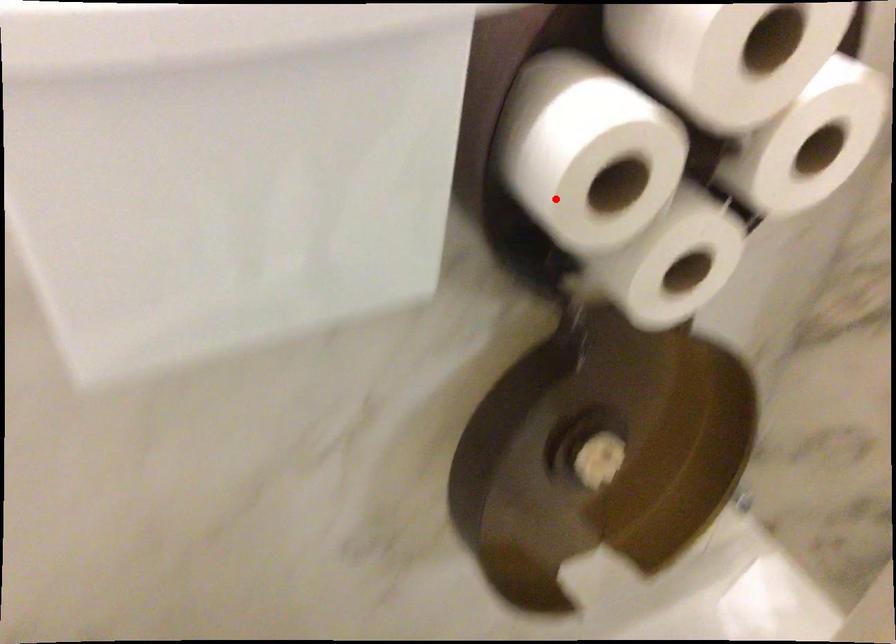
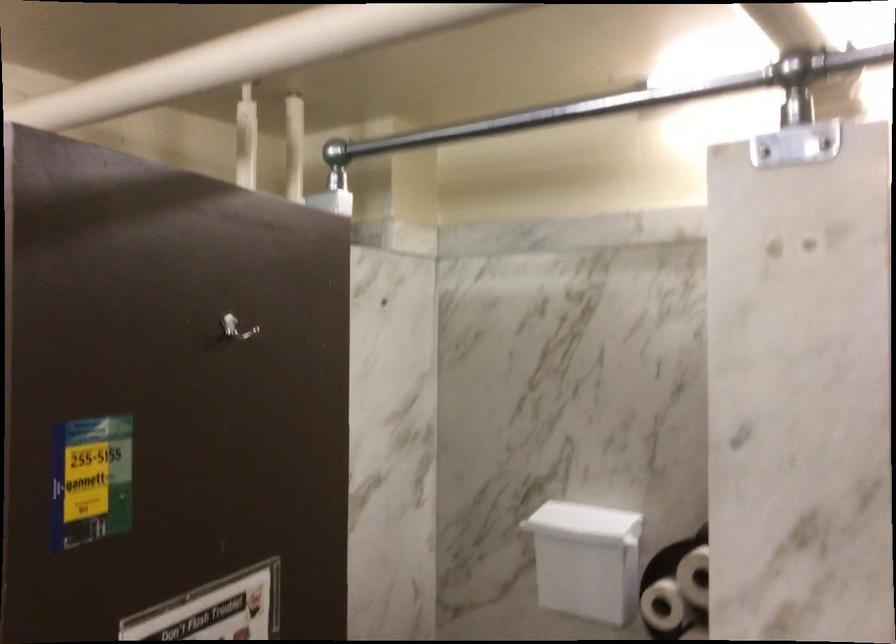
The point at the highlighted location is marked in the first image. Where is the corresponding point in the second image?

(662, 605)